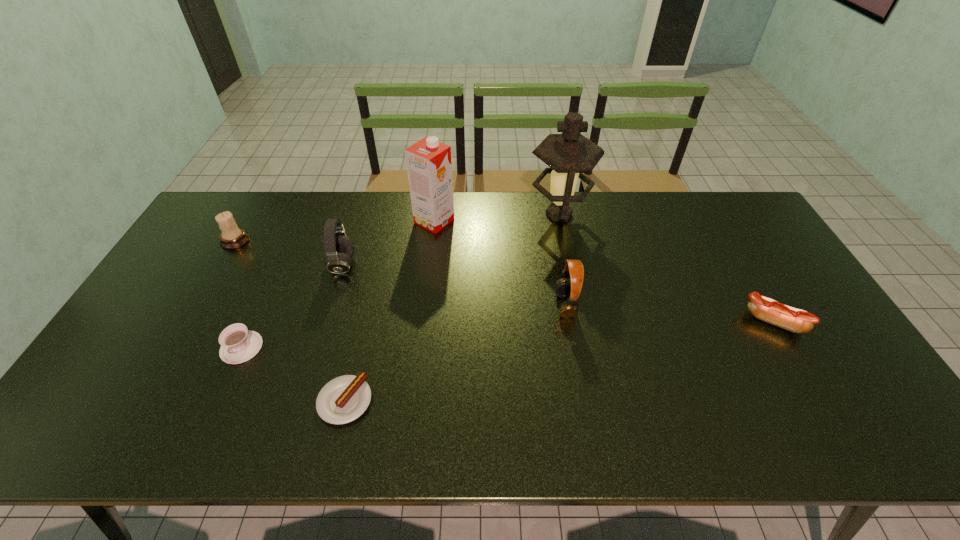
Where is `oil lamp`? The height and width of the screenshot is (540, 960). oil lamp is located at coordinates click(570, 154).

Where is `the seventh shortest object`? Image resolution: width=960 pixels, height=540 pixels. the seventh shortest object is located at coordinates (428, 161).

Where is `the fourth object from right to left`? the fourth object from right to left is located at coordinates (428, 161).

The height and width of the screenshot is (540, 960). Identify the location of the fifth nearest object. (339, 249).

Where is `the left headset`? The width and height of the screenshot is (960, 540). the left headset is located at coordinates (339, 249).

Image resolution: width=960 pixels, height=540 pixels. Identify the location of the nearer headset. (564, 288).

Identify the location of candle holder. The width and height of the screenshot is (960, 540). (232, 237).

This screenshot has height=540, width=960. I want to click on the fifth tallest object, so click(x=232, y=237).

Identify the location of the right sausage. Image resolution: width=960 pixels, height=540 pixels. (766, 309).

Locate an element on the screen. The height and width of the screenshot is (540, 960). the rightmost object is located at coordinates (766, 309).